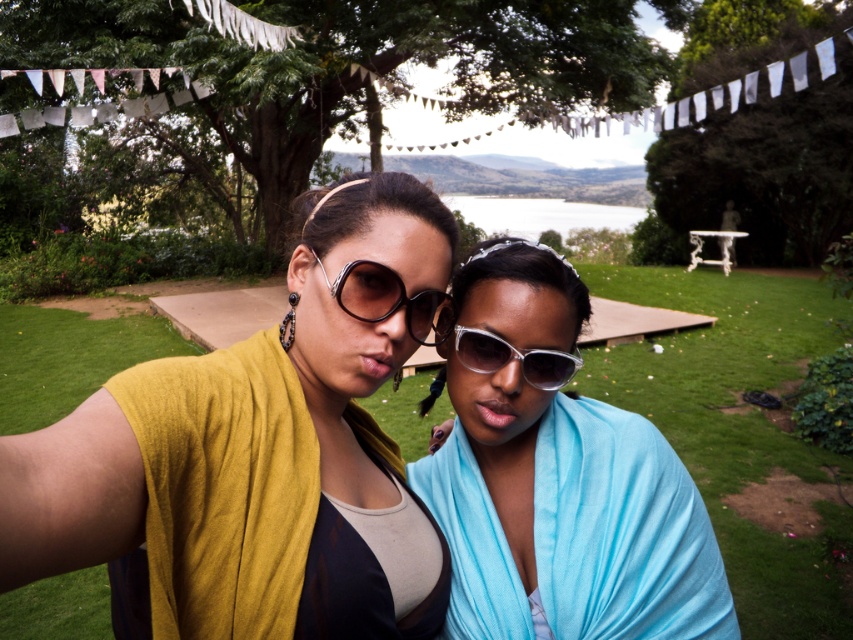
Question: Which point is farther from the camera taking this photo?

Choices:
 (A) (517, 442)
 (B) (363, 272)
 (C) (367, 362)
 (D) (457, 356)

Answer: (A)

Question: Which object is farther from the camera taking this photo?

Choices:
 (A) transparent plastic sunglasses at center
 (B) mustard yellow cardigan at center
 (C) matte black sunglasses at center

Answer: (A)

Question: Is mustard yellow cardigan at center to the left of transparent plastic sunglasses at center from the viewer's perspective?

Choices:
 (A) yes
 (B) no

Answer: (A)

Question: Which point is closer to the camera taking this photo?

Choices:
 (A) (584, 460)
 (B) (409, 317)
 (C) (525, 362)

Answer: (B)

Question: Is translucent white sunglasses at center behind matte black sunglasses at center?

Choices:
 (A) yes
 (B) no

Answer: (A)

Question: Is mustard yellow cardigan at center further to camera compared to matte black sunglasses at center?

Choices:
 (A) no
 (B) yes

Answer: (A)